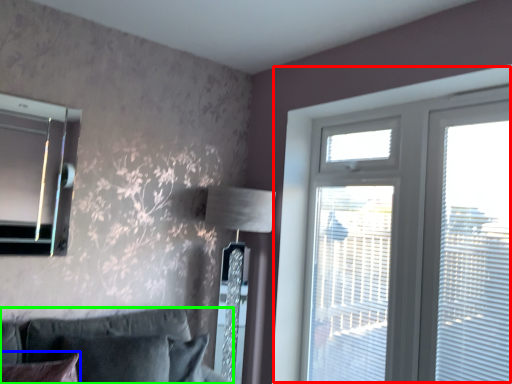
Question: Considering the real-world distances, which object is farthest from window (highlighted by a red box)? pillow (highlighted by a blue box) or studio couch (highlighted by a green box)?

Choices:
 (A) pillow
 (B) studio couch

Answer: (A)